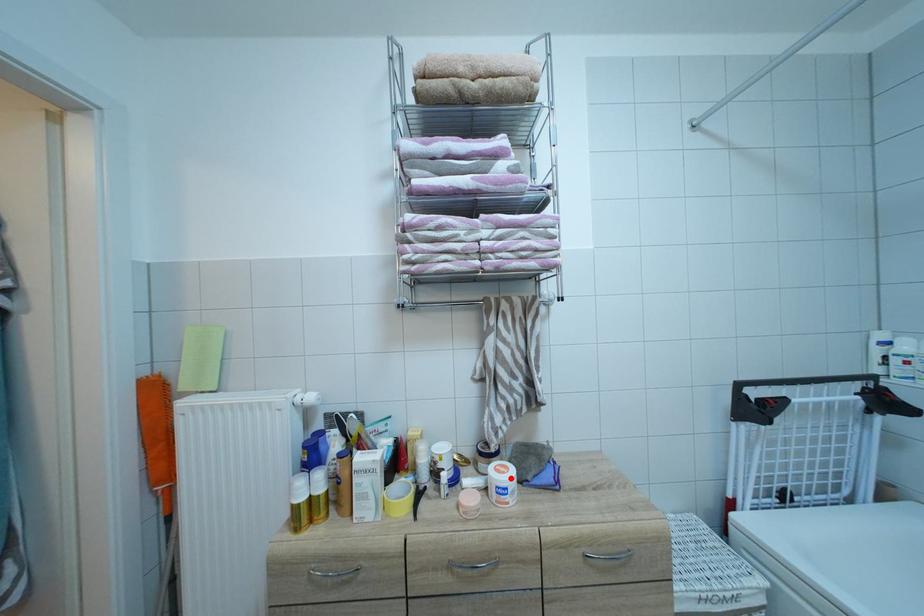
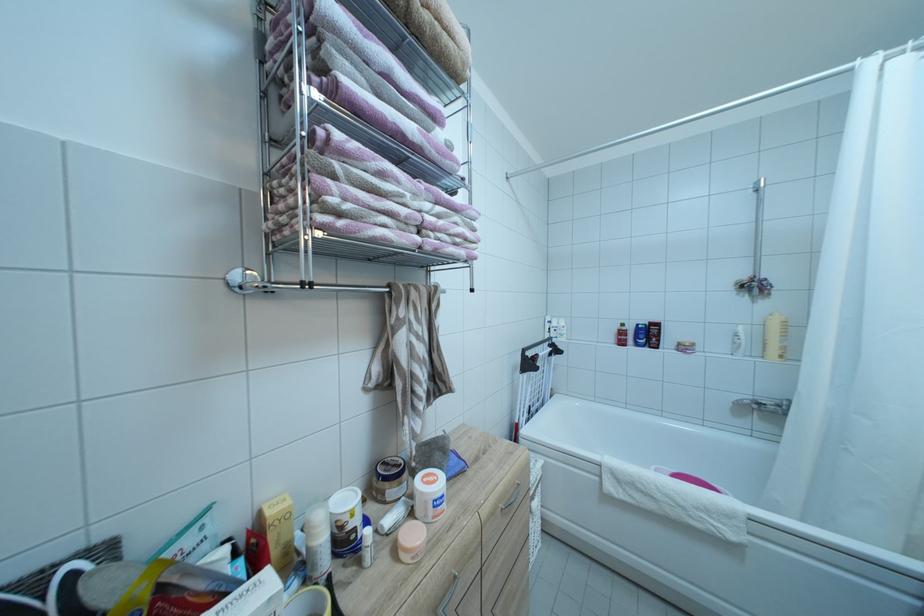
In the second image, find the point that corresponds to the highlighted location in the first image.

(442, 487)